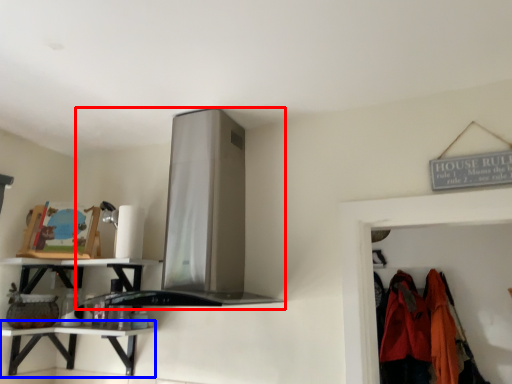
Question: Which of the following is the closest to the observer, exhaust hood (highlighted by a red box) or counter (highlighted by a blue box)?

Choices:
 (A) exhaust hood
 (B) counter

Answer: (A)